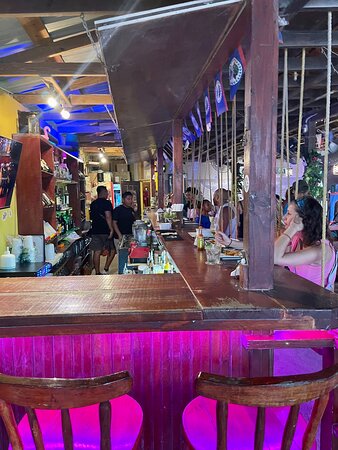
Locate an element on the screen. Image resolution: width=338 pixels, height=450 pixels. bar is located at coordinates (131, 294), (215, 284).